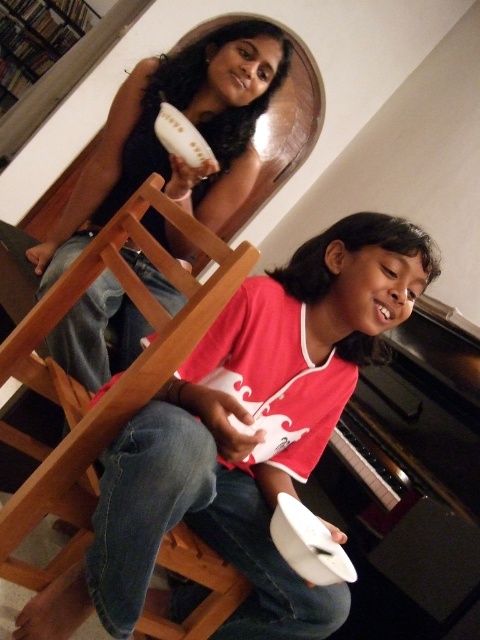
Question: Among these objects, which one is nearest to the camera?

Choices:
 (A) matte black hairbrush at upper center
 (B) white matte plate at center

Answer: (B)

Question: Does white matte plate at center appear on the right side of matte black hairbrush at upper center?

Choices:
 (A) no
 (B) yes

Answer: (B)

Question: Is white matte plate at center positioned before matte black hairbrush at upper center?

Choices:
 (A) yes
 (B) no

Answer: (A)

Question: Among these points, which one is nearest to the camera?

Choices:
 (A) (249, 129)
 (B) (224, 412)

Answer: (B)

Question: Does white matte plate at center have a larger size compared to matte black hairbrush at upper center?

Choices:
 (A) yes
 (B) no

Answer: (A)

Question: Which point is closer to the camera?

Choices:
 (A) (265, 628)
 (B) (207, 45)

Answer: (A)